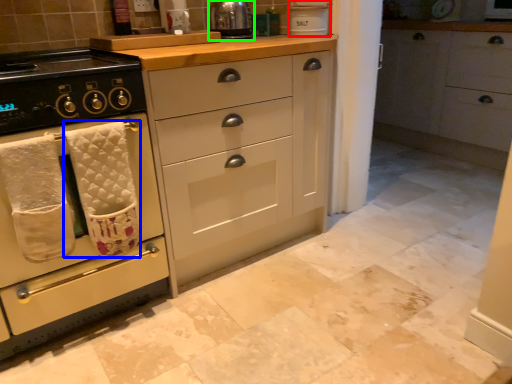
Question: Which object is positioned closest to appliance (highlighted by a red box)? Select from bath towel (highlighted by a blue box) and kitchen appliance (highlighted by a green box).

Choices:
 (A) bath towel
 (B) kitchen appliance

Answer: (B)